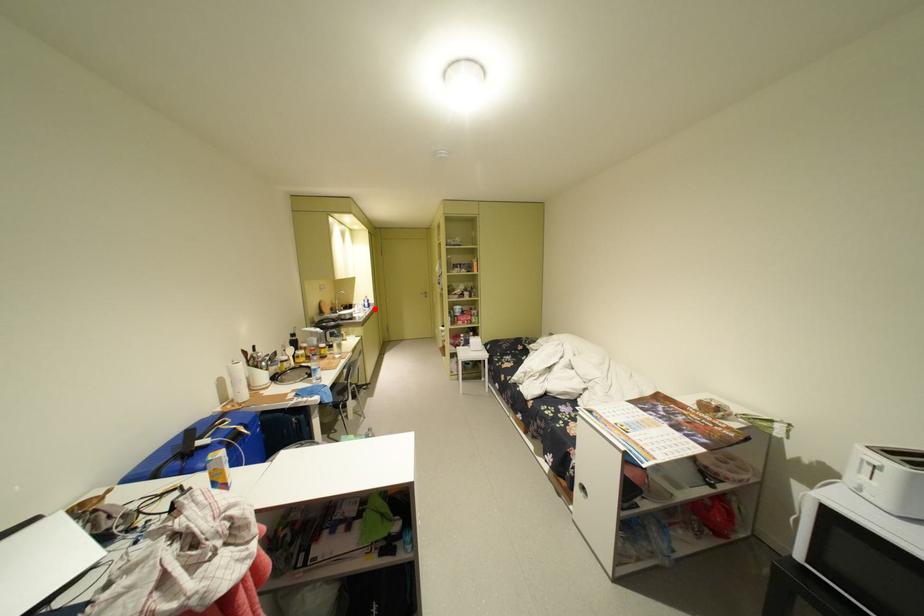
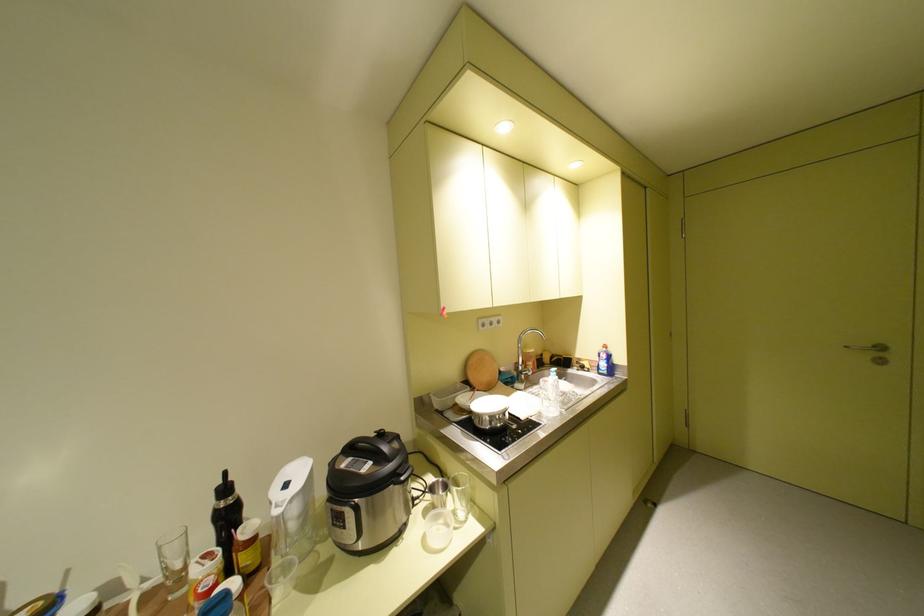
Find the pixel in the second image that matches the highlighted location in the first image.

(603, 376)